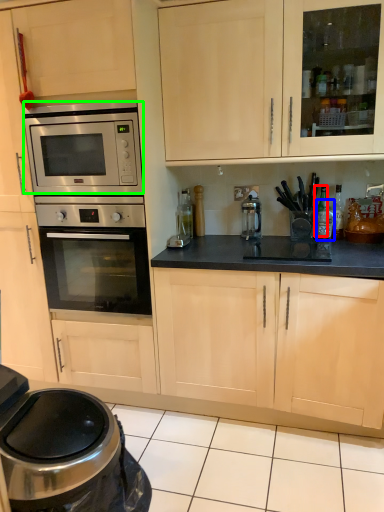
Question: Estimate the real-world distances between objects in this image. Which object is closer to bottle (highlighted by a red box), bottle (highlighted by a blue box) or microwave oven (highlighted by a green box)?

Choices:
 (A) bottle
 (B) microwave oven

Answer: (A)